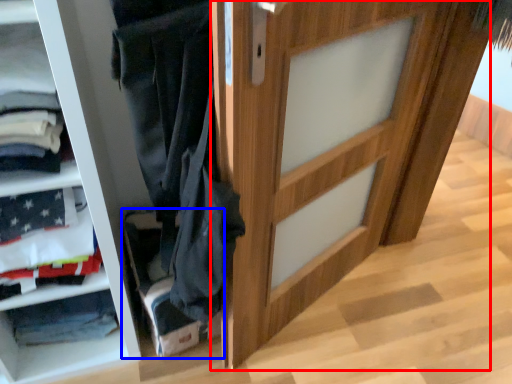
Question: Which point is closer to the camera, door (highlighted by a red box) or shelf (highlighted by a blue box)?

Choices:
 (A) door
 (B) shelf

Answer: (A)